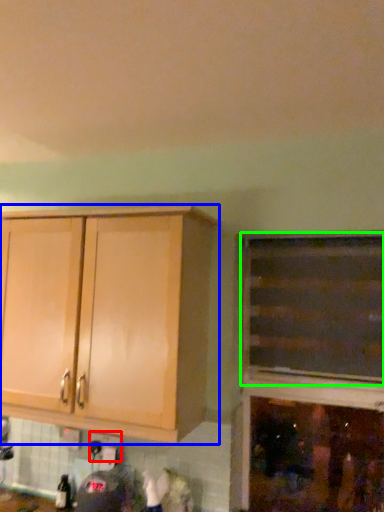
Question: Based on their relative distances, which object is farther from electric outlet (highlighted by a red box)? Choose from cabinetry (highlighted by a blue box) and cabinetry (highlighted by a green box).

Choices:
 (A) cabinetry
 (B) cabinetry

Answer: (B)